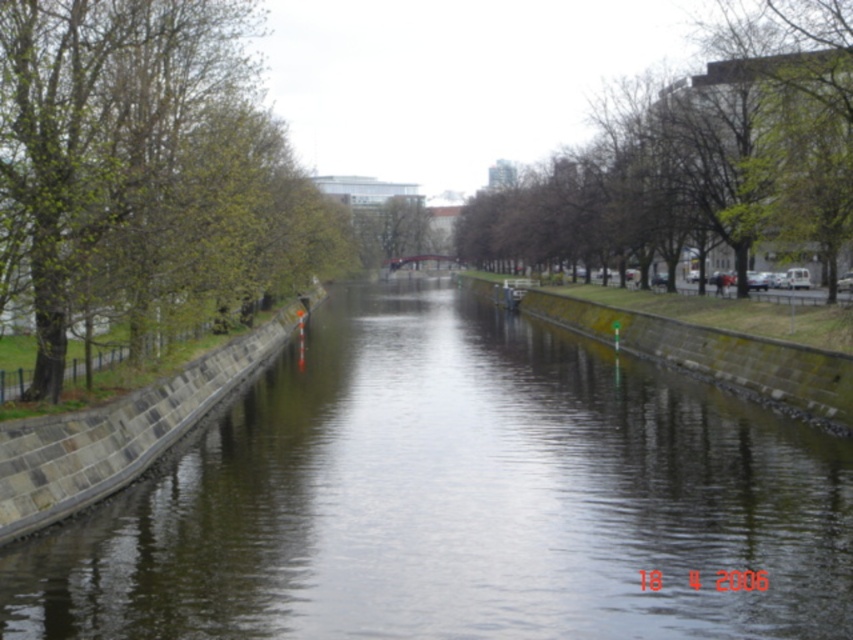
Question: Which object appears closest to the camera in this image?

Choices:
 (A) green leafy tree at upper center
 (B) smooth concrete river at center

Answer: (B)

Question: Which object is positioned closest to the smooth concrete river at center?

Choices:
 (A) green leafy tree at upper center
 (B) green leafy tree at left

Answer: (B)

Question: Does smooth concrete river at center appear on the right side of green leafy tree at upper center?

Choices:
 (A) no
 (B) yes

Answer: (A)

Question: Is smooth concrete river at center positioned at the back of green leafy tree at upper center?

Choices:
 (A) yes
 (B) no

Answer: (B)

Question: Considering the relative positions of smooth concrete river at center and green leafy tree at upper center in the image provided, where is smooth concrete river at center located with respect to green leafy tree at upper center?

Choices:
 (A) left
 (B) right

Answer: (A)

Question: Which object is farther from the camera taking this photo?

Choices:
 (A) smooth concrete river at center
 (B) green leafy tree at upper center
 (C) green leafy tree at left

Answer: (B)